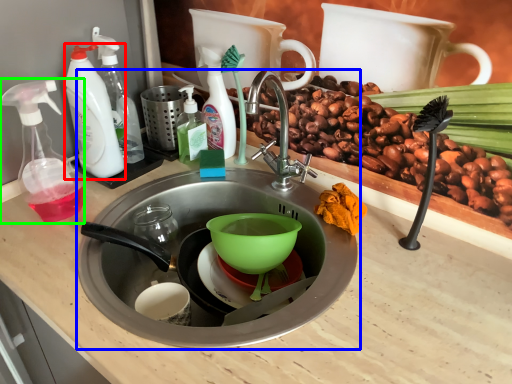
Question: Estimate the real-world distances between objects in this image. Which object is closer to cleaning product (highlighted by a red box), sink (highlighted by a blue box) or soap dispenser (highlighted by a green box)?

Choices:
 (A) sink
 (B) soap dispenser

Answer: (B)